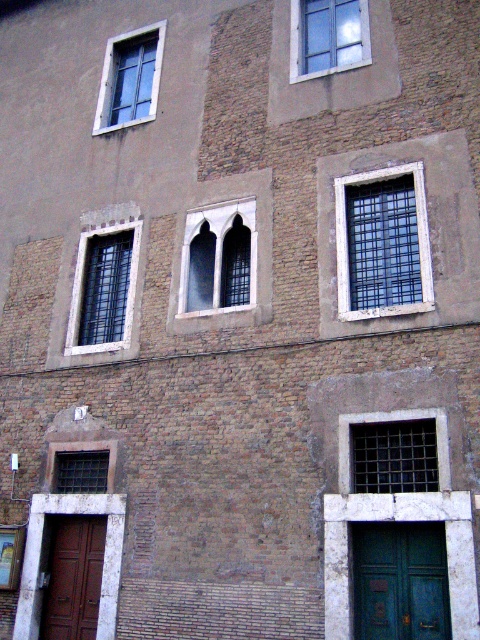
From the picture: Who is lower down, blue glass window at center or gray stone window at center?

gray stone window at center is lower down.

Which is more to the left, blue glass window at center or gray stone window at center?

gray stone window at center

Measure the distance between blue glass window at center and camera.

blue glass window at center and camera are 11.65 meters apart from each other.

Image resolution: width=480 pixels, height=640 pixels. In order to click on blue glass window at center in this screenshot , I will do `click(383, 243)`.

Is point (120, 320) closer to viewer compared to point (71, 540)?

No.

Is matte black window at left to the left of brown wooden door at lower left from the viewer's perspective?

No, matte black window at left is not to the left of brown wooden door at lower left.

Measure the distance between matte black window at left and camera.

14.14 meters

Where is `matte black window at left`? Image resolution: width=480 pixels, height=640 pixels. matte black window at left is located at coordinates (104, 289).

Consider the image. Is gray stone window at center thinner than matte glass window at upper left?

Yes.

Between gray stone window at center and matte glass window at upper left, which one has less height?

gray stone window at center is shorter.

Between point (228, 294) and point (117, 65), which one is positioned behind?

Positioned behind is point (117, 65).

Where is `gray stone window at center`? Image resolution: width=480 pixels, height=640 pixels. gray stone window at center is located at coordinates (218, 259).